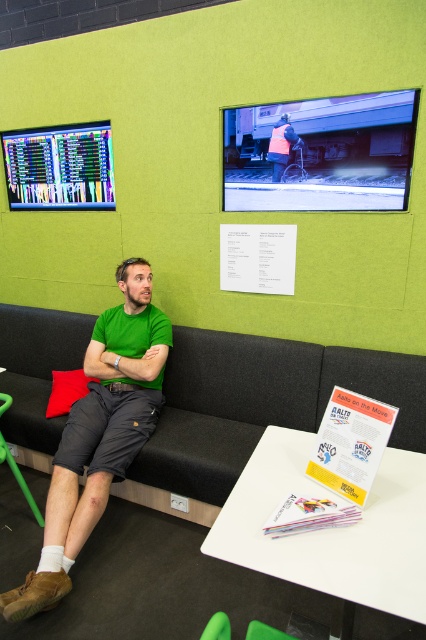
Question: Which is farther from the matte black screen at upper left?

Choices:
 (A) black fabric couch at center
 (B) green matte shirt at center

Answer: (A)

Question: Where is white paper at upper center located in relation to green rubber chair at lower left in the image?

Choices:
 (A) left
 (B) right

Answer: (B)

Question: Which point is farther from the camera taking this photo?

Choices:
 (A) (86, 193)
 (B) (224, 620)

Answer: (A)

Question: Can you confirm if green matte shirt at center is positioned below matte black screen at upper left?

Choices:
 (A) no
 (B) yes

Answer: (B)

Question: Which point is closer to the camera?

Choices:
 (A) (198, 451)
 (B) (276, 429)
 (C) (100, 125)
 (D) (351, 401)

Answer: (D)

Question: Does green matte shirt at center appear over green plastic chair at lower left?

Choices:
 (A) no
 (B) yes

Answer: (B)